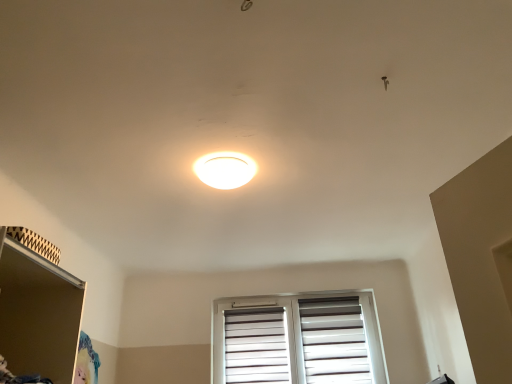
Question: Does matte brown shelf at lower left appear on the left side of white glossy ceiling light at center?

Choices:
 (A) yes
 (B) no

Answer: (A)

Question: Is matte brown shelf at lower left to the right of white glossy ceiling light at center from the viewer's perspective?

Choices:
 (A) yes
 (B) no

Answer: (B)

Question: Is white glossy ceiling light at center at the back of matte brown shelf at lower left?

Choices:
 (A) no
 (B) yes

Answer: (A)

Question: From a real-world perspective, does matte brown shelf at lower left stand above white glossy ceiling light at center?

Choices:
 (A) no
 (B) yes

Answer: (A)

Question: Is matte brown shelf at lower left touching white glossy ceiling light at center?

Choices:
 (A) yes
 (B) no

Answer: (B)

Question: Is white matte window at center spatially inside matte brown shelf at lower left, or outside of it?

Choices:
 (A) inside
 (B) outside

Answer: (B)

Question: Is white matte window at center in front of or behind matte brown shelf at lower left in the image?

Choices:
 (A) behind
 (B) front

Answer: (A)

Question: From the image's perspective, is white matte window at center located above or below matte brown shelf at lower left?

Choices:
 (A) below
 (B) above

Answer: (A)

Question: From a real-world perspective, is white matte window at center positioned above or below matte brown shelf at lower left?

Choices:
 (A) above
 (B) below

Answer: (A)

Question: Considering the positions of white glossy ceiling light at center and white matte window at center in the image, is white glossy ceiling light at center taller or shorter than white matte window at center?

Choices:
 (A) short
 (B) tall

Answer: (A)

Question: In terms of size, does white glossy ceiling light at center appear bigger or smaller than white matte window at center?

Choices:
 (A) small
 (B) big

Answer: (A)

Question: Based on their positions, is white glossy ceiling light at center located to the left or right of white matte window at center?

Choices:
 (A) left
 (B) right

Answer: (A)

Question: In the image, is white glossy ceiling light at center positioned in front of or behind white matte window at center?

Choices:
 (A) behind
 (B) front

Answer: (B)

Question: Looking at their shapes, would you say white glossy ceiling light at center is wider or thinner than matte brown shelf at lower left?

Choices:
 (A) thin
 (B) wide

Answer: (A)

Question: Is white glossy ceiling light at center taller or shorter than matte brown shelf at lower left?

Choices:
 (A) tall
 (B) short

Answer: (B)